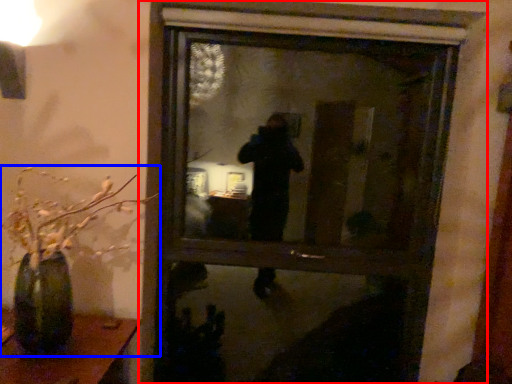
Question: Among these objects, which one is nearest to the camera, window (highlighted by a red box) or houseplant (highlighted by a blue box)?

Choices:
 (A) window
 (B) houseplant

Answer: (B)